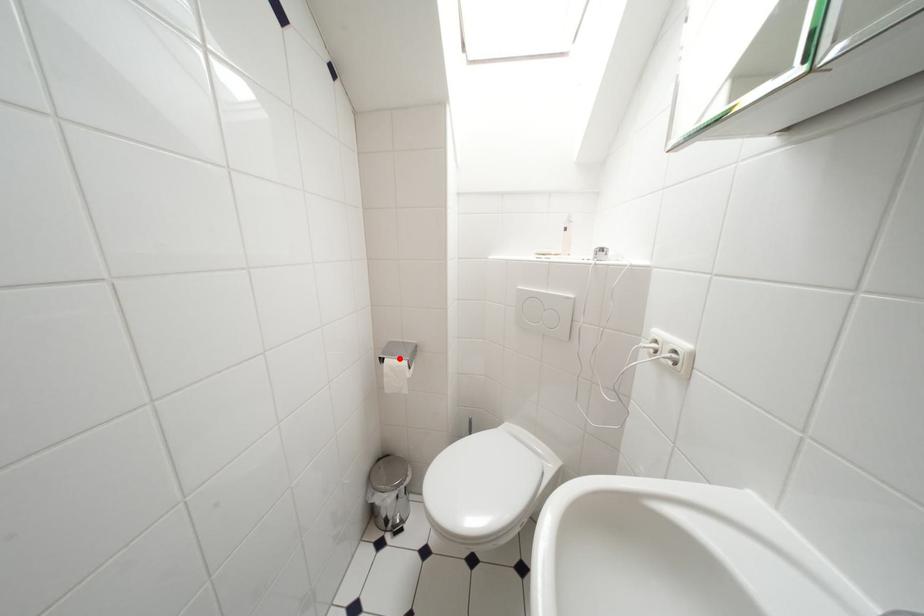
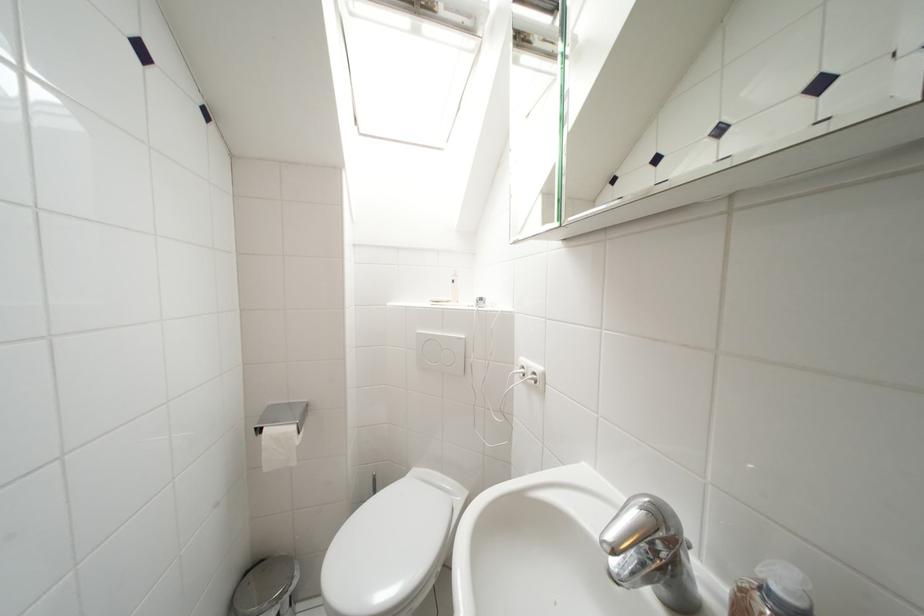
In the second image, find the point that corresponds to the highlighted location in the first image.

(283, 424)